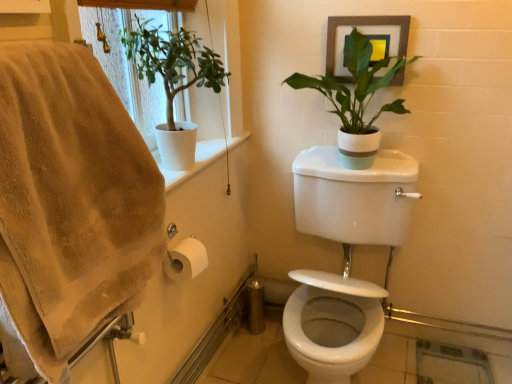
Question: Is white matte plant at upper left, the first houseplant viewed from the left, taller than beige cotton bath towel at left?

Choices:
 (A) no
 (B) yes

Answer: (A)

Question: Considering the relative sizes of white matte plant at upper left, positioned as the 2th houseplant in right-to-left order, and beige cotton bath towel at left in the image provided, is white matte plant at upper left, positioned as the 2th houseplant in right-to-left order, bigger than beige cotton bath towel at left?

Choices:
 (A) no
 (B) yes

Answer: (B)

Question: Is white matte plant at upper left, the first houseplant viewed from the left, positioned far away from beige cotton bath towel at left?

Choices:
 (A) yes
 (B) no

Answer: (B)

Question: From a real-world perspective, is white matte plant at upper left, the first houseplant viewed from the left, positioned under beige cotton bath towel at left based on gravity?

Choices:
 (A) yes
 (B) no

Answer: (B)

Question: Can you confirm if white matte plant at upper left, the first houseplant viewed from the left, is shorter than beige cotton bath towel at left?

Choices:
 (A) yes
 (B) no

Answer: (A)

Question: Can you confirm if white matte plant at upper left, the first houseplant viewed from the left, is wider than beige cotton bath towel at left?

Choices:
 (A) yes
 (B) no

Answer: (A)

Question: Is beige cotton bath towel at left at the back of wooden framed picture at upper right?

Choices:
 (A) no
 (B) yes

Answer: (A)

Question: Is wooden framed picture at upper right aimed at beige cotton bath towel at left?

Choices:
 (A) no
 (B) yes

Answer: (B)

Question: Is wooden framed picture at upper right thinner than beige cotton bath towel at left?

Choices:
 (A) yes
 (B) no

Answer: (A)

Question: Considering the relative positions of wooden framed picture at upper right and beige cotton bath towel at left in the image provided, is wooden framed picture at upper right to the right of beige cotton bath towel at left from the viewer's perspective?

Choices:
 (A) yes
 (B) no

Answer: (A)

Question: Considering the relative sizes of wooden framed picture at upper right and beige cotton bath towel at left in the image provided, is wooden framed picture at upper right smaller than beige cotton bath towel at left?

Choices:
 (A) no
 (B) yes

Answer: (B)

Question: Does wooden framed picture at upper right come behind beige cotton bath towel at left?

Choices:
 (A) yes
 (B) no

Answer: (A)

Question: From the image's perspective, is white matte plant at upper left, positioned as the 2th houseplant in right-to-left order, over white matte pot at upper right, which is counted as the first houseplant, starting from the right?

Choices:
 (A) no
 (B) yes

Answer: (A)